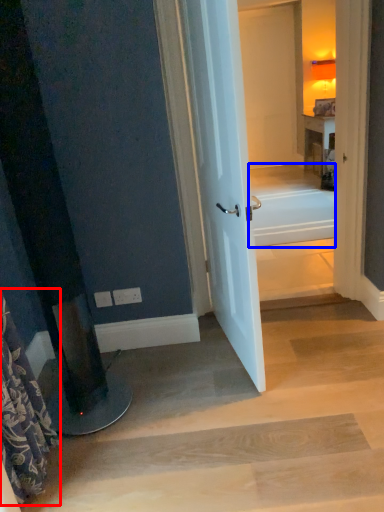
Question: Among these objects, which one is nearest to the camera, shower curtain (highlighted by a red box) or bath (highlighted by a blue box)?

Choices:
 (A) shower curtain
 (B) bath

Answer: (A)